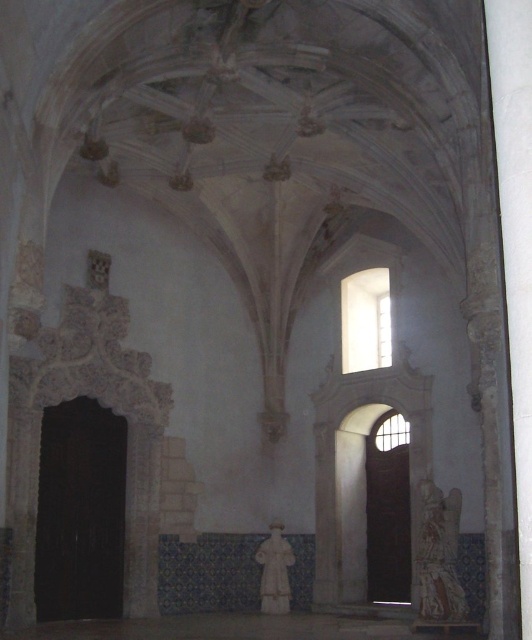
Question: Is carved stone statue at right further to the viewer compared to white marble statue at center?

Choices:
 (A) yes
 (B) no

Answer: (B)

Question: Which point is farther to the camera?

Choices:
 (A) carved stone statue at right
 (B) white marble statue at center

Answer: (B)

Question: Which of the following is the closest to the observer?

Choices:
 (A) (271, 596)
 (B) (428, 532)

Answer: (B)

Question: In this image, where is carved stone statue at right located relative to white marble statue at center?

Choices:
 (A) left
 (B) right

Answer: (B)

Question: Is carved stone statue at right wider than white marble statue at center?

Choices:
 (A) no
 (B) yes

Answer: (B)